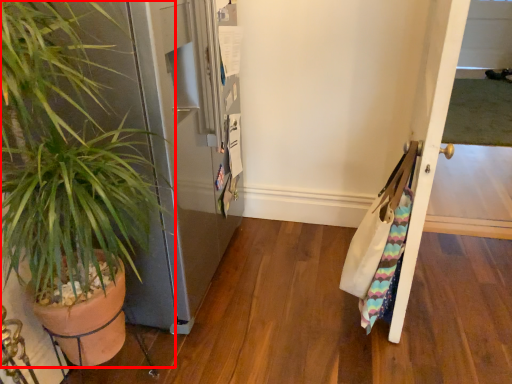
Question: From the image, what is the correct spatial relationship of houseplant (annotated by the red box) in relation to door?

Choices:
 (A) left
 (B) right

Answer: (A)